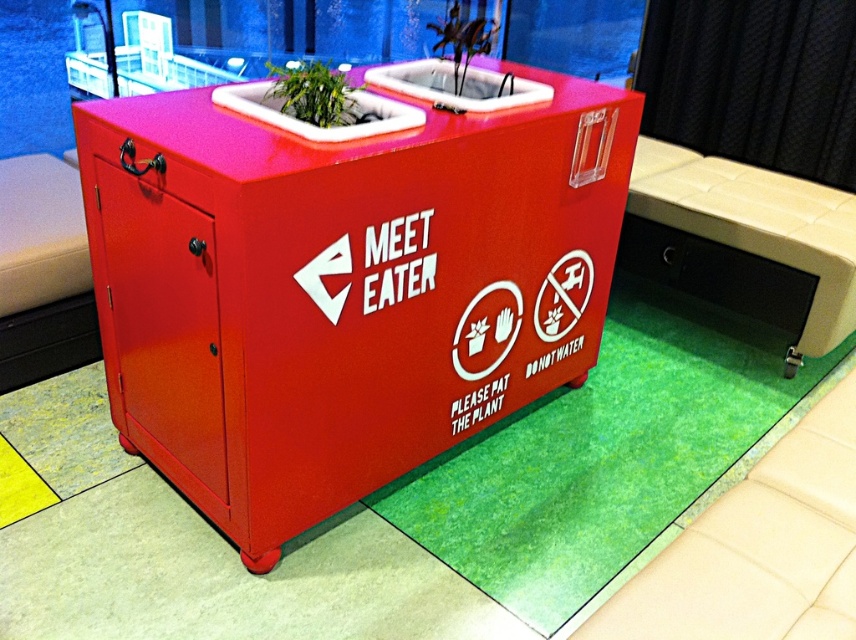
Who is positioned more to the right, green leafy plant at upper center or green matte plant at upper center?

Positioned to the right is green matte plant at upper center.

Looking at this image, which is more to the left, green leafy plant at upper center or green matte plant at upper center?

From the viewer's perspective, green leafy plant at upper center appears more on the left side.

Is point (281, 83) farther from viewer compared to point (462, 45)?

No, (281, 83) is in front of (462, 45).

The image size is (856, 640). What are the coordinates of `green leafy plant at upper center` in the screenshot? It's located at (316, 93).

This screenshot has width=856, height=640. What do you see at coordinates (342, 285) in the screenshot? I see `matte red cooler at center` at bounding box center [342, 285].

Consider the image. Who is taller, matte red cooler at center or green matte plant at upper center?

matte red cooler at center is taller.

Between point (378, 243) and point (459, 26), which one is positioned in front?

Point (378, 243) is in front.

This screenshot has height=640, width=856. Find the location of `matte red cooler at center`. matte red cooler at center is located at coordinates (342, 285).

Which of these two, matte black stool at lower left or green leafy plant at upper center, stands shorter?

Standing shorter between the two is green leafy plant at upper center.

Is point (45, 372) positioned in front of point (343, 74)?

No, (45, 372) is further to viewer.

At what (x,y) coordinates should I click in order to perform the action: click on matte black stool at lower left. Please return your answer as a coordinate pair (x, y). Looking at the image, I should click on (42, 273).